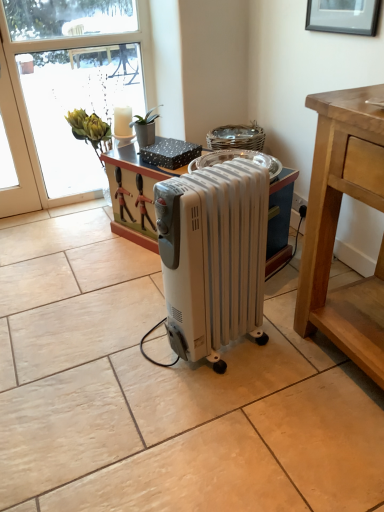
Question: From a real-world perspective, is transparent glass window at upper left physically below black matte picture frame at upper center?

Choices:
 (A) yes
 (B) no

Answer: (A)

Question: Is transparent glass window at upper left facing towards black matte picture frame at upper center?

Choices:
 (A) no
 (B) yes

Answer: (A)

Question: Is transparent glass window at upper left in contact with black matte picture frame at upper center?

Choices:
 (A) yes
 (B) no

Answer: (B)

Question: From a real-world perspective, does transparent glass window at upper left stand above black matte picture frame at upper center?

Choices:
 (A) no
 (B) yes

Answer: (A)

Question: Considering the relative sizes of transparent glass window at upper left and black matte picture frame at upper center in the image provided, is transparent glass window at upper left thinner than black matte picture frame at upper center?

Choices:
 (A) no
 (B) yes

Answer: (A)

Question: Is point (51, 45) positioned closer to the camera than point (362, 26)?

Choices:
 (A) farther
 (B) closer

Answer: (A)

Question: From the image's perspective, is transparent glass window at upper left positioned above or below black matte picture frame at upper center?

Choices:
 (A) above
 (B) below

Answer: (B)

Question: In the image, is transparent glass window at upper left positioned in front of or behind black matte picture frame at upper center?

Choices:
 (A) front
 (B) behind

Answer: (B)

Question: Choose the correct answer: Is transparent glass window at upper left inside black matte picture frame at upper center or outside it?

Choices:
 (A) inside
 (B) outside

Answer: (B)

Question: Is white plastic radiator at center to the left or to the right of black matte picture frame at upper center in the image?

Choices:
 (A) left
 (B) right

Answer: (A)

Question: Would you say white plastic radiator at center is inside or outside black matte picture frame at upper center?

Choices:
 (A) outside
 (B) inside

Answer: (A)

Question: In the image, is white plastic radiator at center positioned in front of or behind black matte picture frame at upper center?

Choices:
 (A) front
 (B) behind

Answer: (A)

Question: Is white plastic radiator at center wider or thinner than black matte picture frame at upper center?

Choices:
 (A) thin
 (B) wide

Answer: (B)

Question: In the image, is black matte picture frame at upper center positioned in front of or behind transparent glass window at upper left?

Choices:
 (A) front
 (B) behind

Answer: (A)

Question: From the image's perspective, is black matte picture frame at upper center positioned above or below transparent glass window at upper left?

Choices:
 (A) below
 (B) above

Answer: (B)